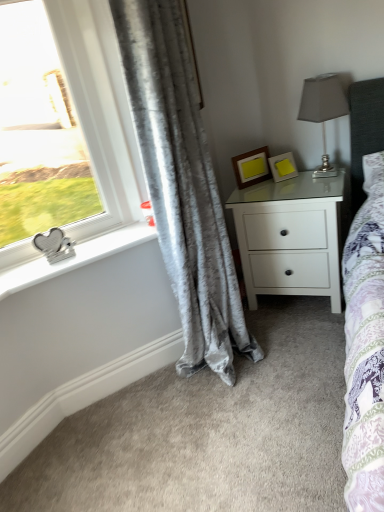
Where is `vacant area that is situated to the right of yellow matte picture frame at upper right, the first picture frame from the right`? The height and width of the screenshot is (512, 384). vacant area that is situated to the right of yellow matte picture frame at upper right, the first picture frame from the right is located at coordinates (313, 175).